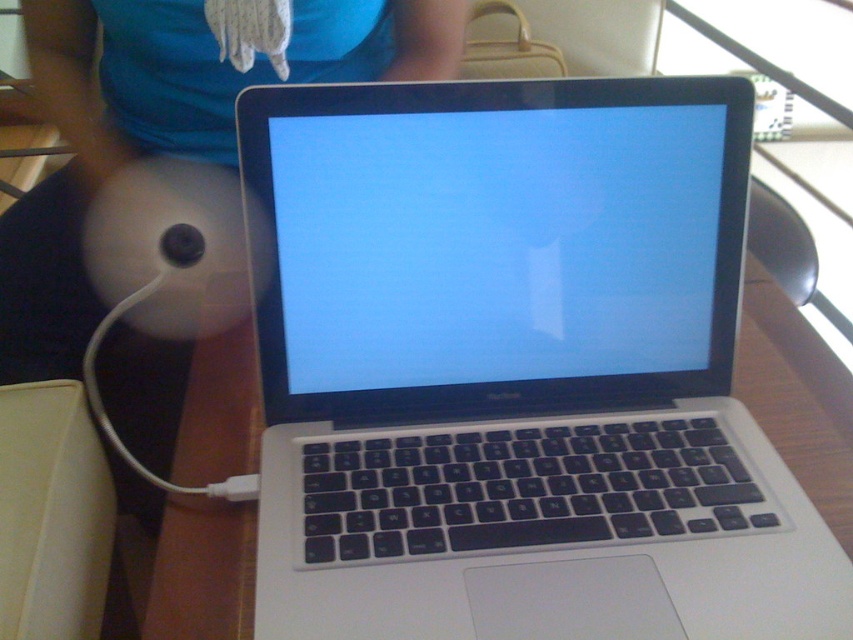
Question: Which point is closer to the camera?

Choices:
 (A) silver metallic laptop at center
 (B) matte white plush at center
 (C) matte plastic screen at center

Answer: (A)

Question: Which of the following is the farthest from the observer?

Choices:
 (A) (90, 83)
 (B) (355, 435)

Answer: (A)

Question: Where is silver metallic laptop at center located in relation to matte plastic screen at center in the image?

Choices:
 (A) below
 (B) above

Answer: (A)

Question: Is the position of matte plastic screen at center more distant than that of matte white plush at center?

Choices:
 (A) yes
 (B) no

Answer: (B)

Question: Is silver metallic laptop at center wider than matte plastic screen at center?

Choices:
 (A) no
 (B) yes

Answer: (B)

Question: Estimate the real-world distances between objects in this image. Which object is closer to the matte plastic screen at center?

Choices:
 (A) silver metallic laptop at center
 (B) matte white plush at center

Answer: (A)